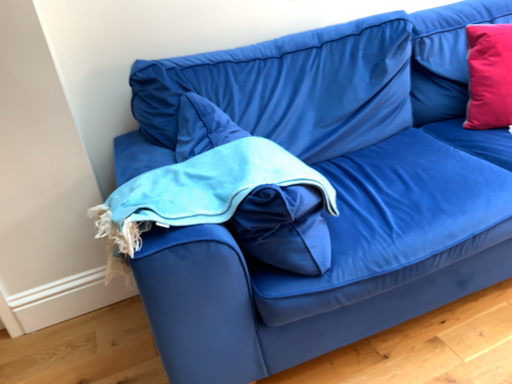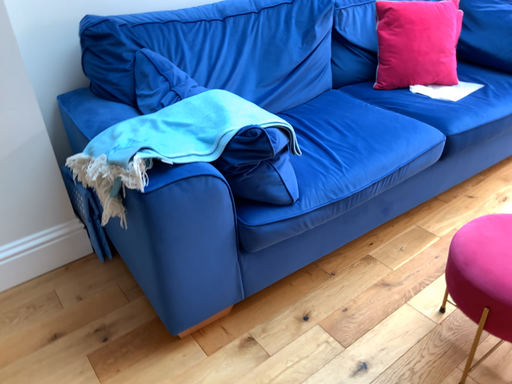
Question: How did the camera likely rotate when shooting the video?

Choices:
 (A) rotated left
 (B) rotated right

Answer: (B)